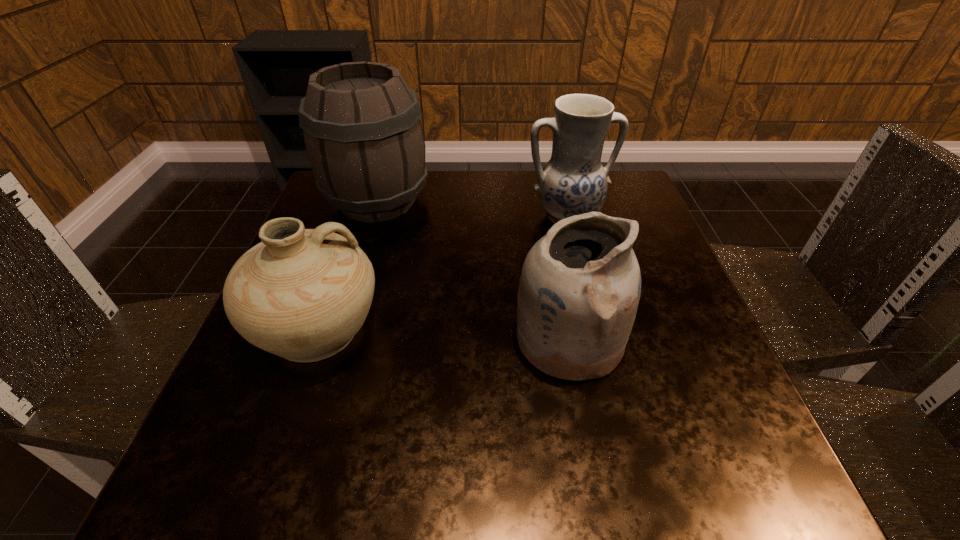
Locate an element on the screen. object positioned at the far left corner is located at coordinates (364, 141).

At what (x,y) coordinates should I click in order to perform the action: click on object that is at the far right corner. Please return your answer as a coordinate pair (x, y). The height and width of the screenshot is (540, 960). Looking at the image, I should click on (573, 182).

Identify the location of free spot at the far edge of the desktop. This screenshot has height=540, width=960. (497, 206).

I want to click on blank space at the near edge of the desktop, so click(x=586, y=476).

At what (x,y) coordinates should I click in order to perform the action: click on free space at the right edge of the desktop. Please return your answer as a coordinate pair (x, y). The width and height of the screenshot is (960, 540). Looking at the image, I should click on (636, 247).

This screenshot has height=540, width=960. In the image, there is a desktop. Identify the location of free space at the near left corner. (210, 487).

This screenshot has width=960, height=540. In the image, there is a desktop. Identify the location of blank space at the far right corner. (627, 176).

This screenshot has height=540, width=960. Find the location of `free space at the near right corner of the desktop`. free space at the near right corner of the desktop is located at coordinates (733, 448).

Locate an element on the screen. This screenshot has height=540, width=960. free spot between the farthest pottery and the leftmost pottery is located at coordinates (443, 273).

At what (x,y) coordinates should I click in order to perform the action: click on vacant point located between the farthest pottery and the wine bucket. Please return your answer as a coordinate pair (x, y). Looking at the image, I should click on (472, 208).